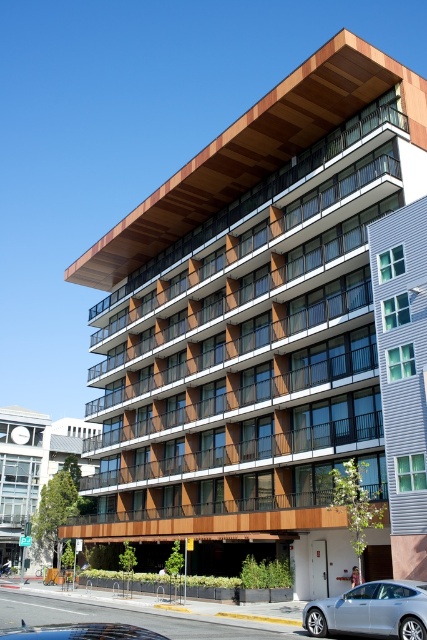
You are standing on the sidewalk in front of the modern multi story building. You want to estimate how far the green glass windows at upper right are from you. What is the approximate distance?

The green glass windows at upper right are approximately 27.99 meters away from the viewer.

You are a pedestrian standing on the sidewalk in front of the building. You see the green glass windows at upper right and the silver metallic car at lower right. Which object is closer to you?

The silver metallic car at lower right is behind the green glass windows at upper right, so the green glass windows at upper right are closer to you.

You are standing in front of the modern multi story building and want to take a photo. There are two points marked on your camera screen at coordinates point (17, 500) and point (368, 605). Which point is closer to you?

Point (17, 500) is further to the camera than point (368, 605), so the point closer to you is point (368, 605).